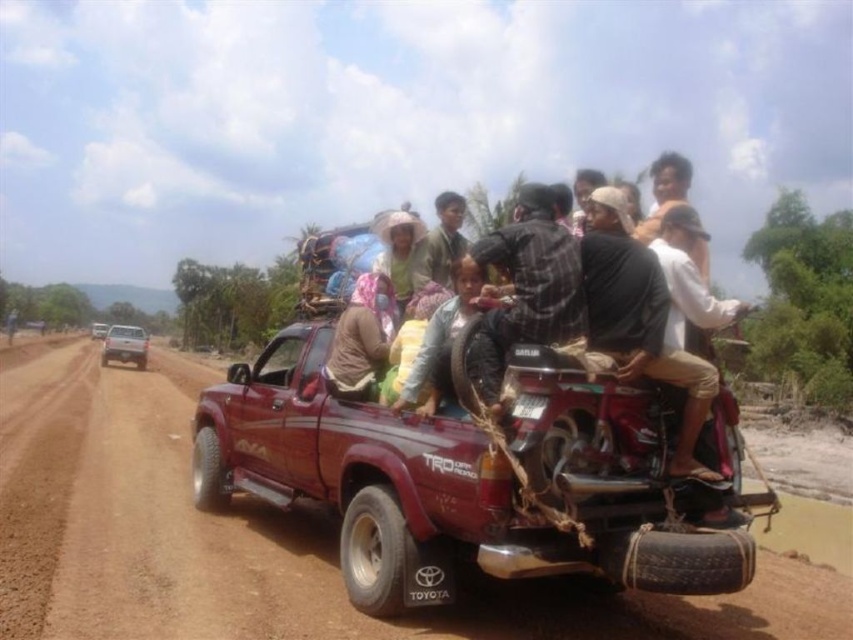
You are a hiker who needs to cross the brown fabric bag at center and the brown dirt track at center. Which one should you step on to continue your path?

You should step on the brown dirt track at center because it is to the left of the brown fabric bag at center, so it is part of the path and more suitable for walking on compared to the bag.